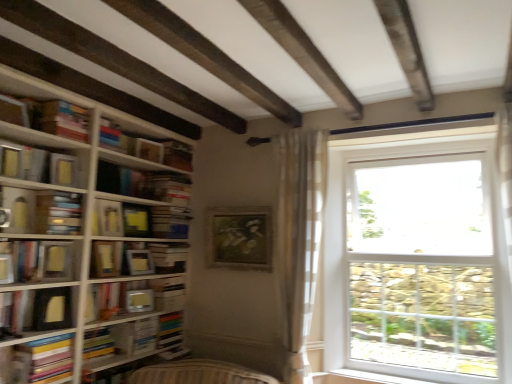
Question: Can we say white plastic window sill at lower right lies outside hardcover book at center-left, which is counted as the third book, starting from the bottom?

Choices:
 (A) no
 (B) yes

Answer: (B)

Question: From a real-world perspective, does white plastic window sill at lower right sit lower than hardcover book at center-left, which is counted as the third book, starting from the bottom?

Choices:
 (A) yes
 (B) no

Answer: (A)

Question: From the image's perspective, is white plastic window sill at lower right below hardcover book at center-left, acting as the 2th book starting from the top?

Choices:
 (A) yes
 (B) no

Answer: (A)

Question: Could hardcover book at center-left, acting as the 2th book starting from the top, be considered to be inside white plastic window sill at lower right?

Choices:
 (A) no
 (B) yes

Answer: (A)

Question: Considering the relative sizes of white plastic window sill at lower right and hardcover book at center-left, which is counted as the third book, starting from the bottom, in the image provided, is white plastic window sill at lower right thinner than hardcover book at center-left, which is counted as the third book, starting from the bottom,?

Choices:
 (A) yes
 (B) no

Answer: (A)

Question: Is yellow matte paper at upper left, which appears as the second paperback book when viewed from the top, bigger or smaller than white plastic window sill at lower right?

Choices:
 (A) small
 (B) big

Answer: (A)

Question: From a real-world perspective, is yellow matte paper at upper left, which appears as the eighth paperback book when ordered from the bottom, positioned above or below white plastic window sill at lower right?

Choices:
 (A) below
 (B) above

Answer: (B)

Question: Considering the positions of yellow matte paper at upper left, which appears as the second paperback book when viewed from the top, and white plastic window sill at lower right in the image, is yellow matte paper at upper left, which appears as the second paperback book when viewed from the top, taller or shorter than white plastic window sill at lower right?

Choices:
 (A) short
 (B) tall

Answer: (B)

Question: Is yellow matte paper at upper left, which appears as the second paperback book when viewed from the top, situated inside white plastic window sill at lower right or outside?

Choices:
 (A) inside
 (B) outside

Answer: (B)

Question: Considering the positions of matte black book at upper center, which is the 1th paperback book from top to bottom, and hardcover book at lower left, the 4th book viewed from the top, in the image, is matte black book at upper center, which is the 1th paperback book from top to bottom, wider or thinner than hardcover book at lower left, the 4th book viewed from the top,?

Choices:
 (A) wide
 (B) thin

Answer: (B)

Question: Is point click(135, 142) positioned closer to the camera than point click(111, 362)?

Choices:
 (A) farther
 (B) closer

Answer: (A)

Question: Would you say matte black book at upper center, acting as the ninth paperback book starting from the bottom, is to the left or to the right of hardcover book at lower left, the first book positioned from the bottom, in the picture?

Choices:
 (A) left
 (B) right

Answer: (B)

Question: From a real-world perspective, is matte black book at upper center, acting as the ninth paperback book starting from the bottom, physically located above or below hardcover book at lower left, the first book positioned from the bottom?

Choices:
 (A) below
 (B) above

Answer: (B)

Question: Is hardcover book at lower left, the 4th book viewed from the top, in front of or behind matte yellow book at left, which is the 4th book in bottom-to-top order, in the image?

Choices:
 (A) front
 (B) behind

Answer: (B)

Question: Does point (129, 326) appear closer or farther from the camera than point (1, 162)?

Choices:
 (A) farther
 (B) closer

Answer: (A)